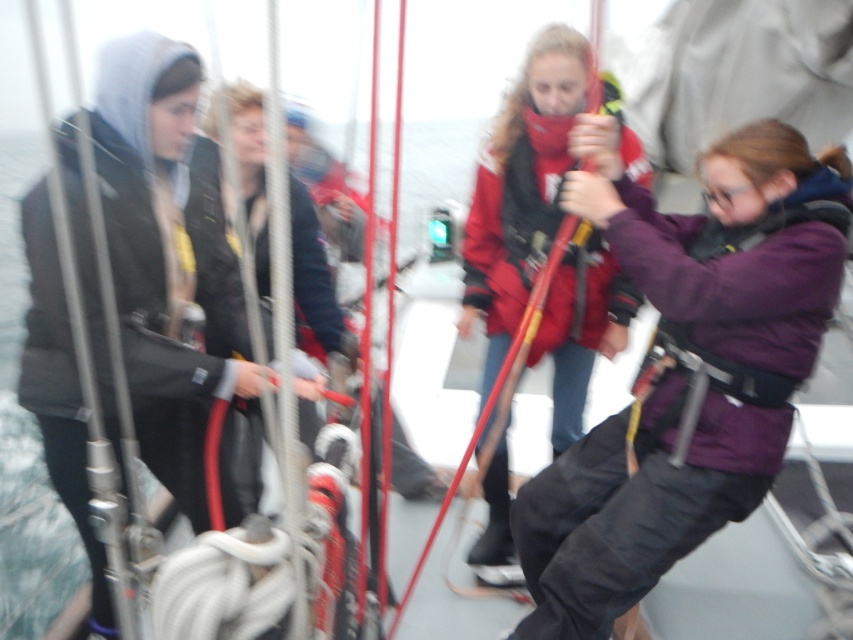
You are a crew member on the boat and need to pass a rope to the person in the purple fleece jacket at center and the person in the matte black jacket at left. Which person is closer to your left side?

The matte black jacket at left is closer to your left side because the purple fleece jacket at center is positioned on the right side of matte black jacket at left.

You are a photographer trying to capture a clear photo of the purple fleece jacket at center and the matte black jacket at left. Since the scene is blurred, you decide to adjust your camera focus. Which jacket should you focus on first to ensure both are in focus?

The matte black jacket at left is behind the purple fleece jacket at center, so you should focus on the purple fleece jacket at center first to ensure both are in focus.